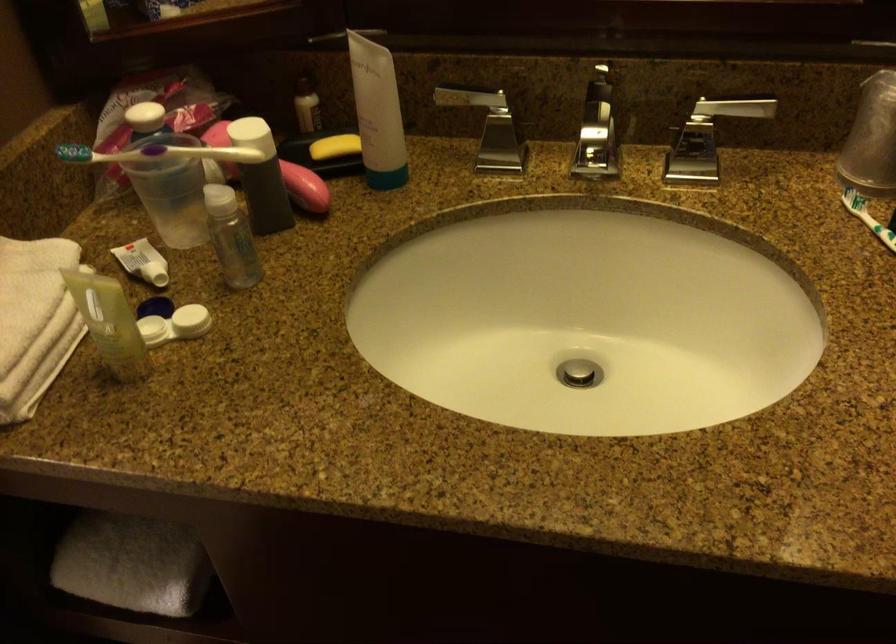
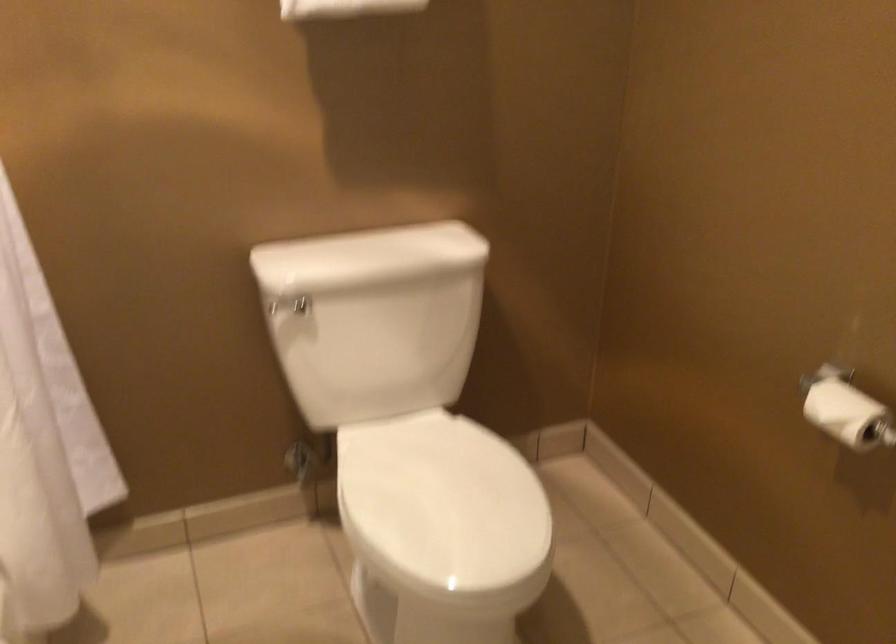
Question: The camera is either moving clockwise (left) or counter-clockwise (right) around the object. The first image is from the beginning of the video and the second image is from the end. Is the camera moving left or right when shooting the video?

Choices:
 (A) Left
 (B) Right

Answer: (B)